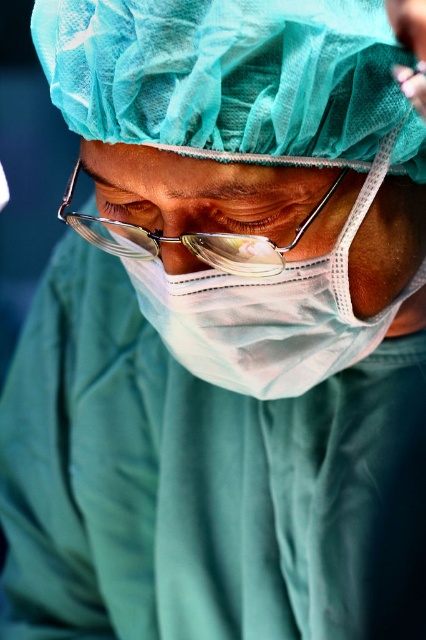
From the picture: Which is more to the right, white matte mask at center or metallic wire frame glasses at center?

white matte mask at center

Is white matte mask at center taller than metallic wire frame glasses at center?

Yes.

Which is behind, point (409, 285) or point (117, 241)?

The point (117, 241) is more distant.

The height and width of the screenshot is (640, 426). In order to click on white matte mask at center in this screenshot , I will do `click(253, 300)`.